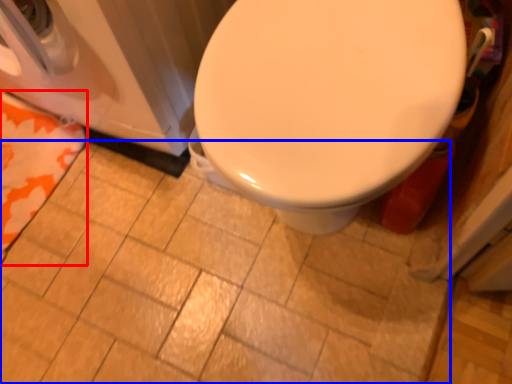
Question: Which point is closer to the camera, beach towel (highlighted by a red box) or ceramic tile (highlighted by a blue box)?

Choices:
 (A) beach towel
 (B) ceramic tile

Answer: (B)